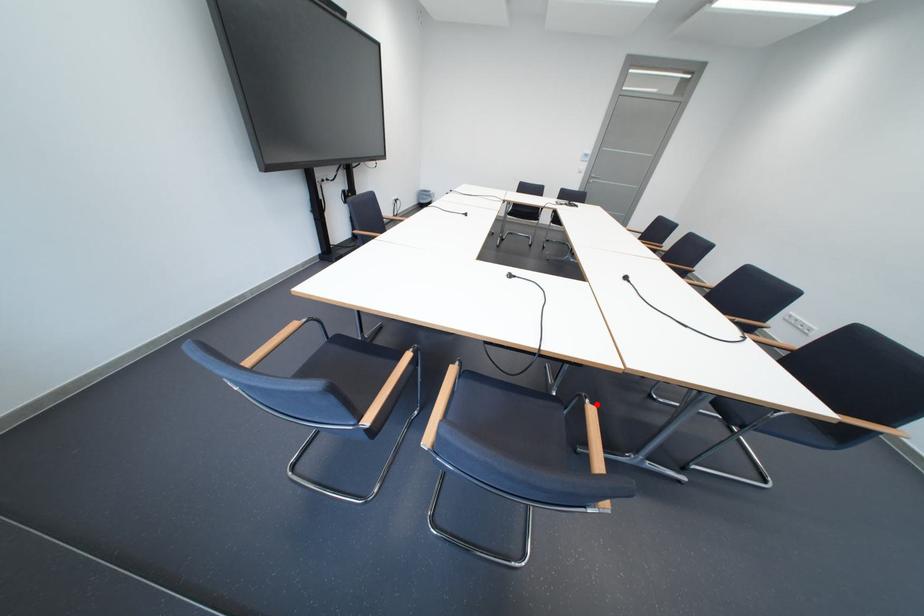
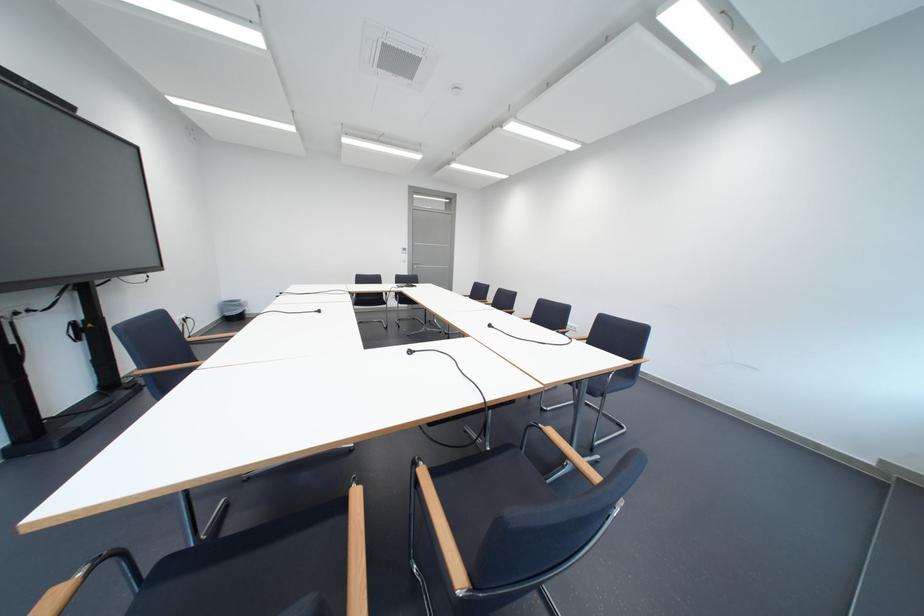
Question: I am providing you with two images of the same scene from different viewpoints. Image1 has a red point marked. In image2, the corresponding 3D location appears at what relative position? Reply with the corresponding letter.

Choices:
 (A) Closer
 (B) Farther

Answer: (A)